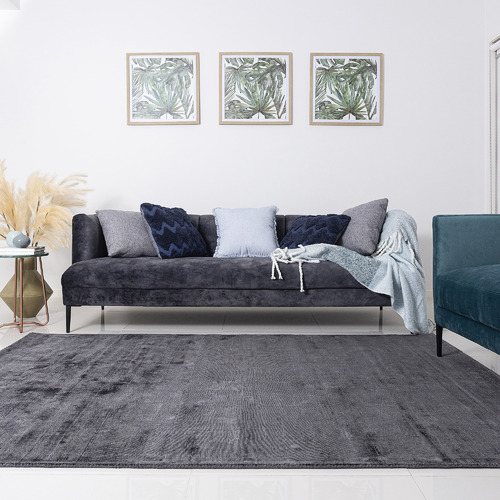
Image resolution: width=500 pixels, height=500 pixels. In order to click on vase in this screenshot , I will do `click(33, 289)`.